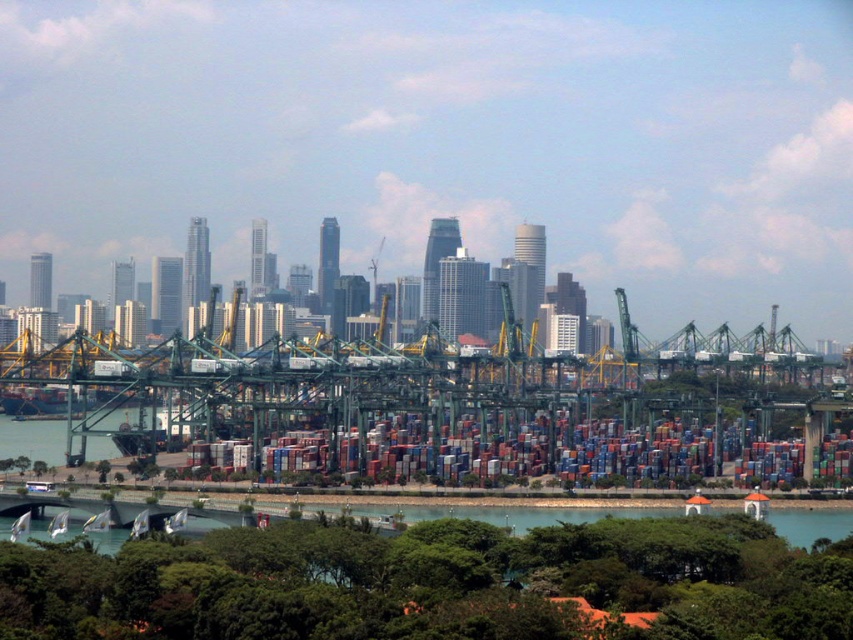
Is point (334, 451) positioned in front of point (36, 534)?

Yes, point (334, 451) is closer to viewer.

Describe the element at coordinates (538, 452) in the screenshot. The height and width of the screenshot is (640, 853). I see `metallic containers at center` at that location.

I want to click on metallic containers at center, so click(538, 452).